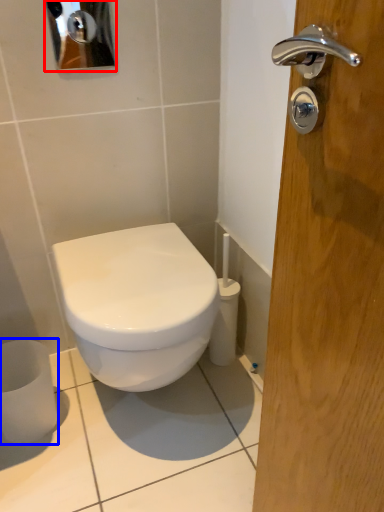
Question: Which point is closer to the camera, mirror (highlighted by a red box) or toilet paper (highlighted by a blue box)?

Choices:
 (A) mirror
 (B) toilet paper

Answer: (A)